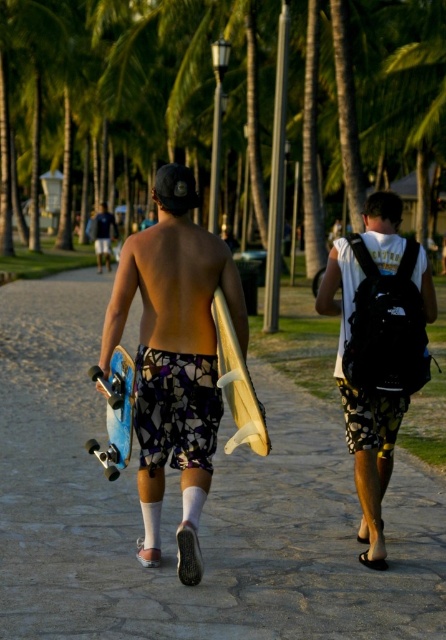
Can you confirm if black matte backpack at center is bigger than printed fabric shorts at center?

Yes, black matte backpack at center is bigger than printed fabric shorts at center.

Which is behind, point (379, 456) or point (166, 380)?

The point (379, 456) is behind.

Identify the location of black matte backpack at center. (378, 348).

Is matte surfboard at center wider than dark blue t-shirt at upper left?

No.

Does point (140, 426) come behind point (99, 266)?

No, it is in front of (99, 266).

Who is more forward, (203, 321) or (104, 208)?

Positioned in front is point (203, 321).

Locate an element on the screen. matte surfboard at center is located at coordinates (174, 356).

Between matte surfboard at center and blue matte surfboard at center, which one has less height?

With less height is blue matte surfboard at center.

Is point (181, 580) farther from viewer compared to point (115, 392)?

No, it is in front of (115, 392).

Does point (209, 426) lie behind point (131, 406)?

That is True.

Identify the location of matte surfboard at center. (174, 356).